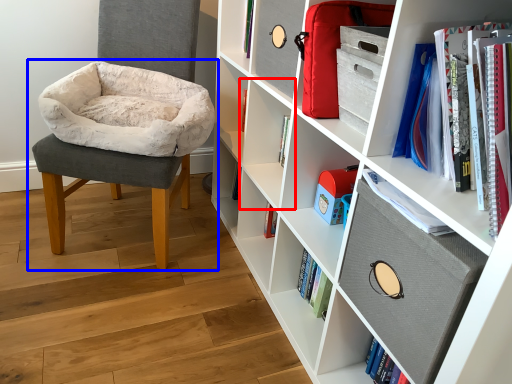
Question: Which object appears closest to the camera in this image, shelf (highlighted by a red box) or chair (highlighted by a blue box)?

Choices:
 (A) shelf
 (B) chair

Answer: (B)